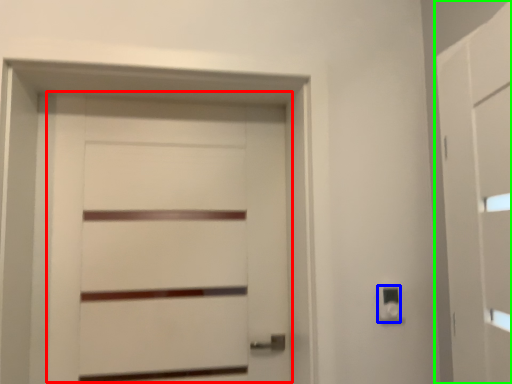
Question: Which object is positioned farthest from door (highlighted by a red box)? Select from light switch (highlighted by a blue box) and barn door (highlighted by a green box).

Choices:
 (A) light switch
 (B) barn door

Answer: (B)